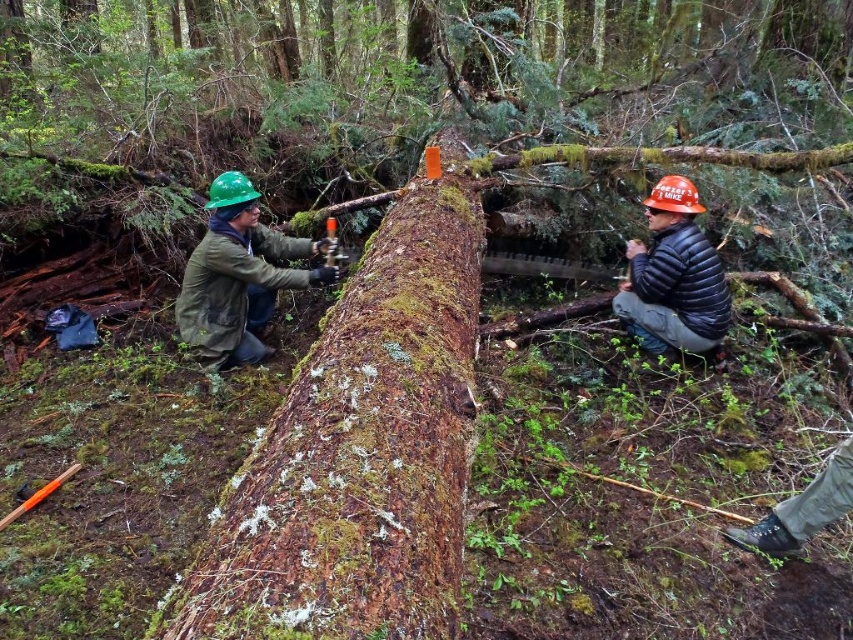
Question: Is green matte helmet at left below orange hard hat at right?

Choices:
 (A) yes
 (B) no

Answer: (B)

Question: From the image, what is the correct spatial relationship of moss-covered bark at center in relation to orange hard hat at right?

Choices:
 (A) above
 (B) below

Answer: (B)

Question: Which point is farther from the camera taking this photo?

Choices:
 (A) (469, 188)
 (B) (328, 269)

Answer: (B)

Question: Among these points, which one is farthest from the camera?

Choices:
 (A) (663, 225)
 (B) (303, 280)

Answer: (B)

Question: Which point appears closest to the camera in this image?

Choices:
 (A) (256, 253)
 (B) (477, 301)

Answer: (B)

Question: Is the position of moss-covered bark at center less distant than that of orange hard hat at right?

Choices:
 (A) no
 (B) yes

Answer: (B)